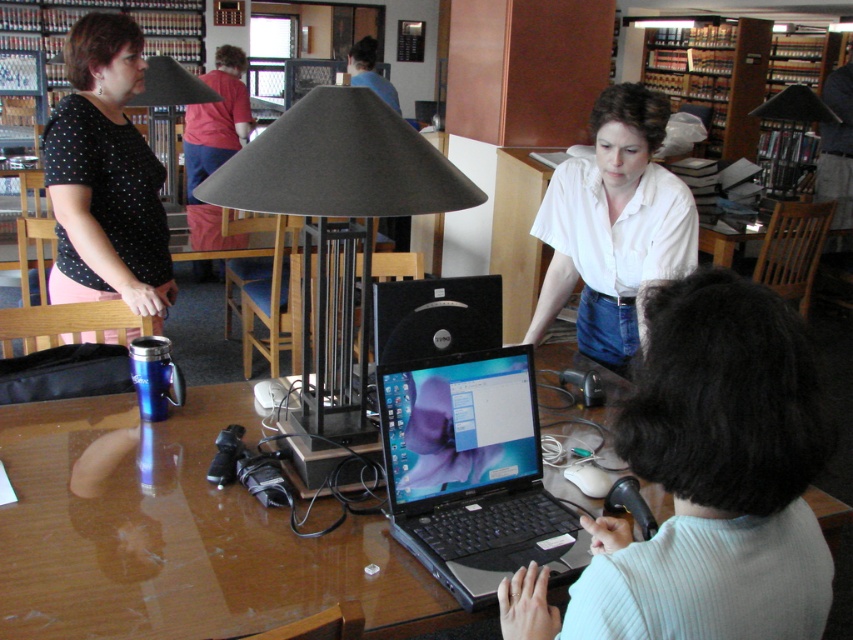
Is glossy wood table at center to the right of black matte lamp at center from the viewer's perspective?

In fact, glossy wood table at center is to the left of black matte lamp at center.

Between point (393, 620) and point (367, 99), which one is positioned behind?

Point (367, 99)

Where is `glossy wood table at center`? This screenshot has height=640, width=853. glossy wood table at center is located at coordinates (177, 532).

The image size is (853, 640). Identify the location of glossy wood table at center. (177, 532).

Which is below, black plastic laptop at center or black matte lamp at center?

black plastic laptop at center

Is black plastic laptop at center above black matte lamp at center?

Incorrect, black plastic laptop at center is not positioned above black matte lamp at center.

Is point (556, 547) closer to viewer compared to point (323, 358)?

Yes, point (556, 547) is closer to viewer.

At what (x,y) coordinates should I click in order to perform the action: click on black plastic laptop at center. Please return your answer as a coordinate pair (x, y). Looking at the image, I should click on (473, 472).

Can you confirm if glossy wood table at center is wider than wooden bookshelf at upper right?

Indeed, glossy wood table at center has a greater width compared to wooden bookshelf at upper right.

You are a GUI agent. You are given a task and a screenshot of the screen. Output one action in this format:
    pyautogui.click(x=<x>, y=<y>)
    Task: Click on the glossy wood table at center
    
    Given the screenshot: What is the action you would take?
    pyautogui.click(x=177, y=532)